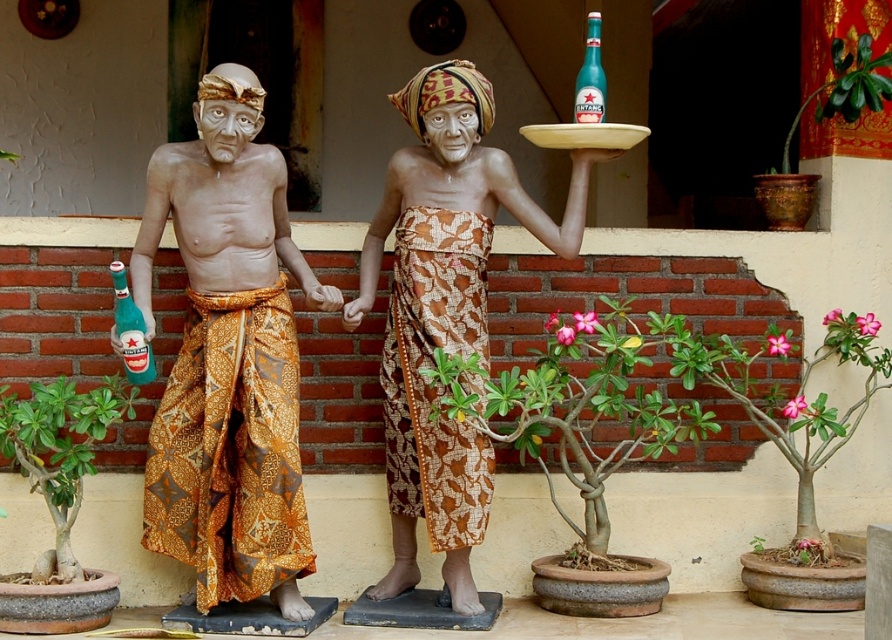
Is point (269, 308) farther from camera compared to point (392, 595)?

No.

Can you confirm if matte orange batik sarong at left is positioned to the right of batik fabric statue at center?

No, matte orange batik sarong at left is not to the right of batik fabric statue at center.

Does point (285, 173) come farther from viewer compared to point (436, 180)?

No, it is in front of (436, 180).

At what (x,y) coordinates should I click in order to perform the action: click on matte orange batik sarong at left. Please return your answer as a coordinate pair (x, y). Looking at the image, I should click on (228, 378).

Is point (213, 115) positioned behind point (591, 99)?

That is False.

Can you confirm if matte clay face at center is positioned to the right of teal glass beer bottle at upper center?

In fact, matte clay face at center is to the left of teal glass beer bottle at upper center.

Where is `matte clay face at center`? The image size is (892, 640). matte clay face at center is located at coordinates (226, 128).

Does matte clay face at center have a lesser width compared to green glass bottle at left?

No, matte clay face at center is not thinner than green glass bottle at left.

Who is higher up, matte clay face at center or green glass bottle at left?

matte clay face at center

Which is in front, point (207, 120) or point (137, 346)?

Positioned in front is point (207, 120).

Identify the location of matte clay face at center. 226,128.